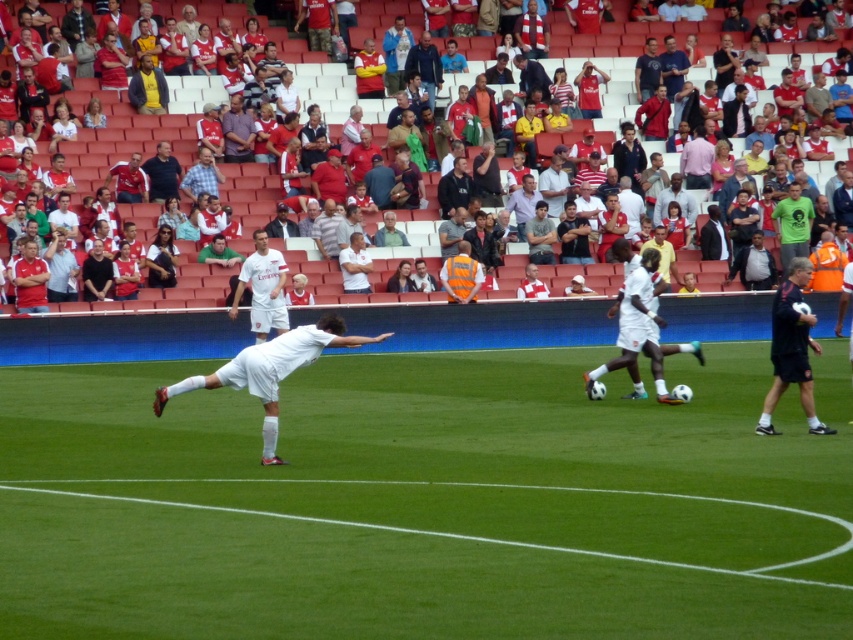
Question: Estimate the real-world distances between objects in this image. Which object is closer to the dark blue shirt at center?

Choices:
 (A) white smooth soccer ball at right
 (B) white matte soccer player at center
 (C) white fabric crowd at upper center
 (D) green grass field at center

Answer: (C)

Question: Is white fabric crowd at upper center in front of white cotton shirt at center?

Choices:
 (A) no
 (B) yes

Answer: (B)

Question: Based on their relative distances, which object is farther from the dark blue shirt at center?

Choices:
 (A) white jersey at center
 (B) green grass field at center
 (C) white fabric crowd at upper center
 (D) white smooth soccer ball at right

Answer: (D)

Question: Is white matte soccer player at center to the right of dark blue shirt at center from the viewer's perspective?

Choices:
 (A) no
 (B) yes

Answer: (B)

Question: Is white matte soccer player at center positioned at the back of white jersey at center?

Choices:
 (A) yes
 (B) no

Answer: (B)

Question: Among these points, which one is nearest to the camera?

Choices:
 (A) (271, 291)
 (B) (190, 381)

Answer: (B)